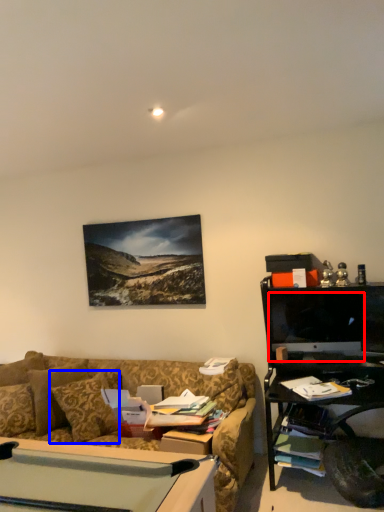
Question: Which object is closer to the camera taking this photo, computer monitor (highlighted by a red box) or pillow (highlighted by a blue box)?

Choices:
 (A) computer monitor
 (B) pillow

Answer: (B)